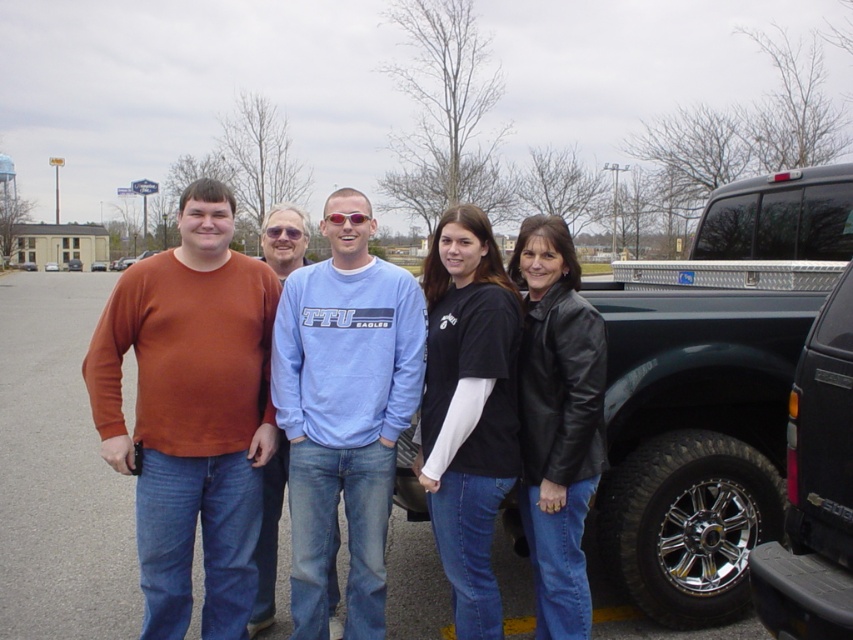
From the picture: You are standing in a parking lot and see a group of people. There is a point at coordinates (190, 413). Which object from the scene does this point belong to?

The point at coordinates (190, 413) belongs to the matte orange sweater at left.